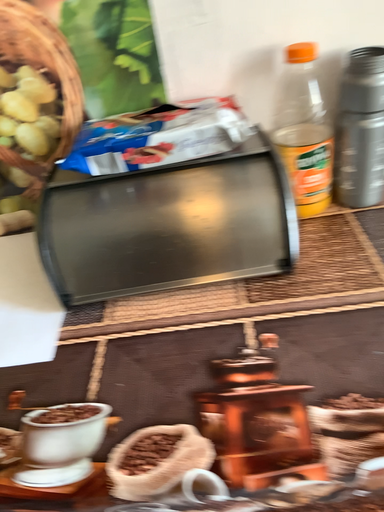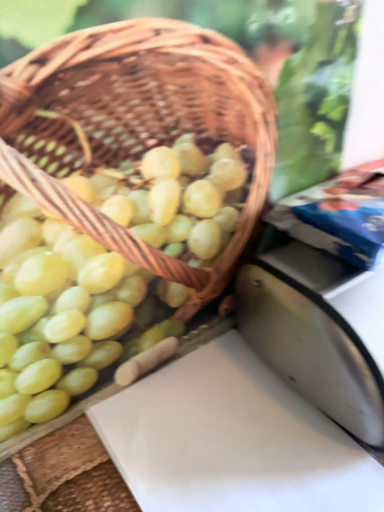
Question: Which way did the camera rotate in the video?

Choices:
 (A) rotated upward
 (B) rotated downward

Answer: (A)